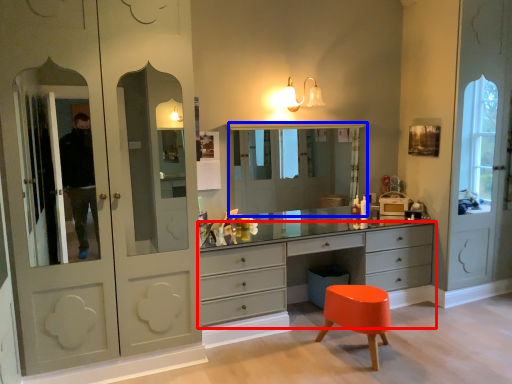
Question: Which object appears closest to the camera in this image, chest of drawers (highlighted by a red box) or medicine cabinet (highlighted by a blue box)?

Choices:
 (A) chest of drawers
 (B) medicine cabinet

Answer: (A)